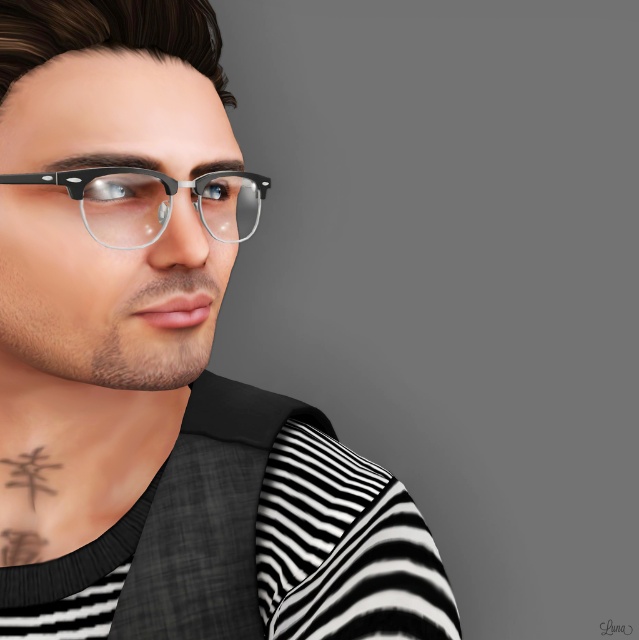
Question: Which point is closer to the camera taking this photo?

Choices:
 (A) [x=243, y=192]
 (B) [x=183, y=112]
 (C) [x=26, y=426]

Answer: (B)

Question: Does matte black vest at center appear over black matte tattoo at lower left?

Choices:
 (A) yes
 (B) no

Answer: (A)

Question: Which of these objects is positioned closest to the matte black frame glasses at upper left?

Choices:
 (A) matte black vest at center
 (B) black matte tattoo at lower left

Answer: (A)

Question: Is black striped shirt at center wider than matte black frame glasses at upper left?

Choices:
 (A) no
 (B) yes

Answer: (B)

Question: Which is farther from the matte black vest at center?

Choices:
 (A) black matte tattoo at lower left
 (B) matte black frame glasses at upper left

Answer: (B)

Question: Observing the image, what is the correct spatial positioning of black matte tattoo at lower left in reference to matte black frame glasses at upper left?

Choices:
 (A) below
 (B) above

Answer: (A)